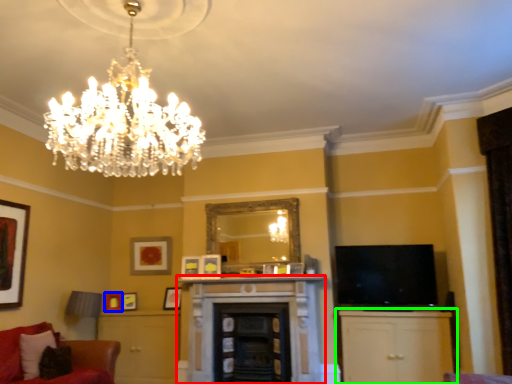
Question: Which object is positioned closest to fireplace (highlighted by a red box)? Select from picture frame (highlighted by a blue box) and cabinetry (highlighted by a green box).

Choices:
 (A) picture frame
 (B) cabinetry

Answer: (B)